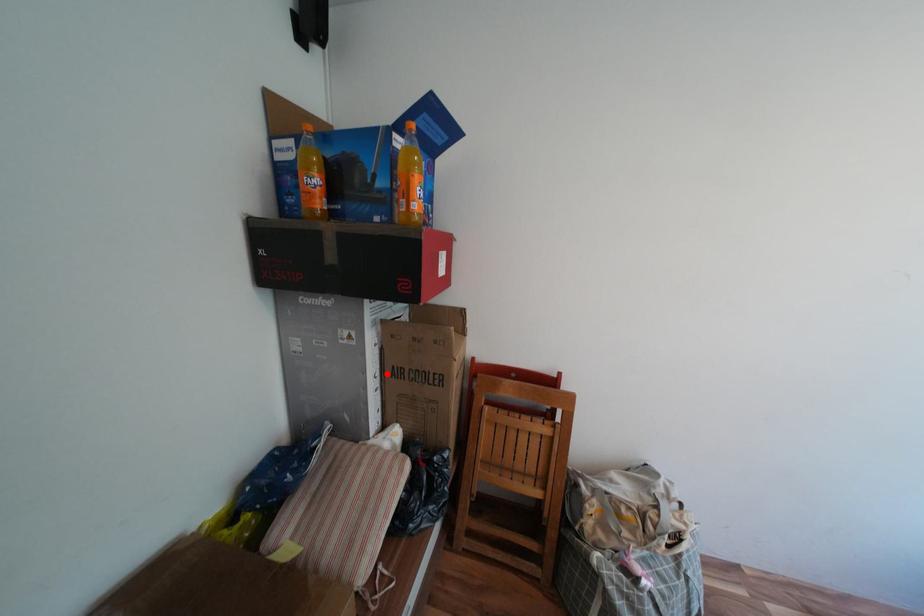
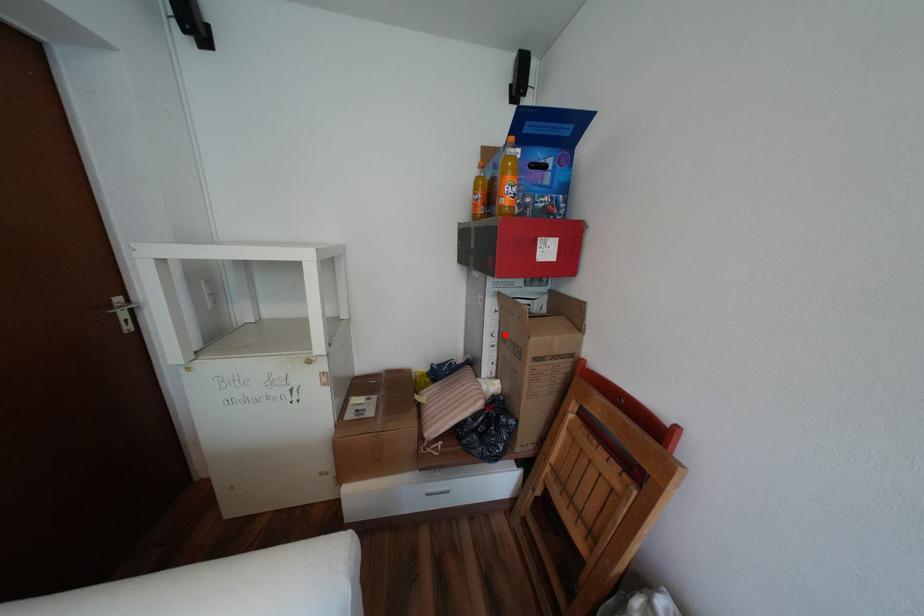
I am providing you with two images of the same scene from different viewpoints. A red point is marked on the first image and another point is marked on the second image. Are the points marked in image1 and image2 representing the same 3D position?

Yes